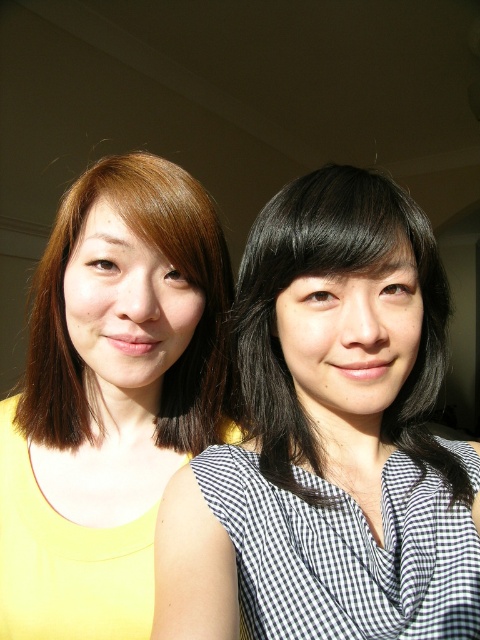
Question: Which object is farther from the camera taking this photo?

Choices:
 (A) yellow matte tank top at left
 (B) black checkered blouse at center

Answer: (A)

Question: Which of the following is the farthest from the observer?

Choices:
 (A) (315, 412)
 (B) (36, 502)

Answer: (B)

Question: Is black checkered blouse at center below yellow matte tank top at left?

Choices:
 (A) yes
 (B) no

Answer: (B)

Question: Does black checkered blouse at center lie behind yellow matte tank top at left?

Choices:
 (A) no
 (B) yes

Answer: (A)

Question: Is black checkered blouse at center bigger than yellow matte tank top at left?

Choices:
 (A) no
 (B) yes

Answer: (B)

Question: Which object appears closest to the camera in this image?

Choices:
 (A) yellow matte tank top at left
 (B) black checkered blouse at center

Answer: (B)